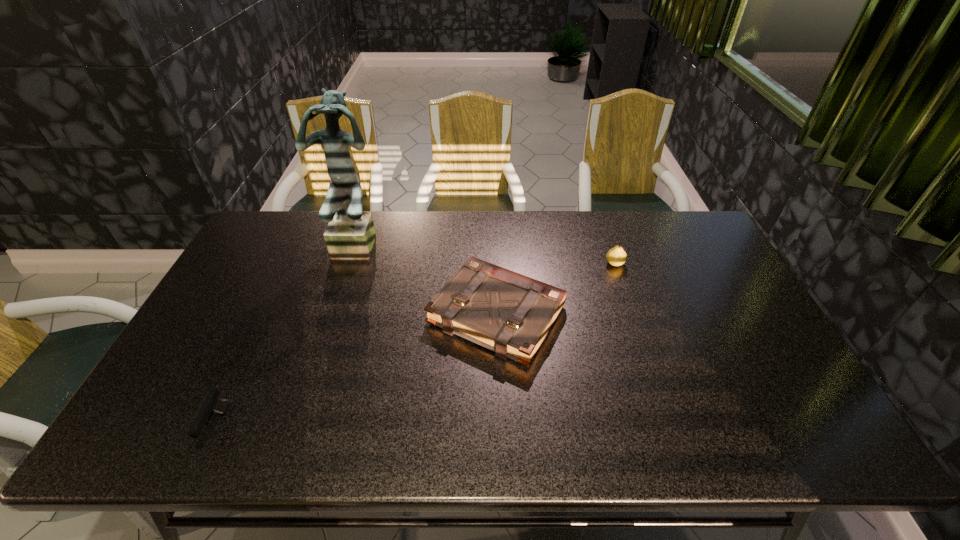
The width and height of the screenshot is (960, 540). I want to click on free space between the pistol and the third object from right to left, so click(x=289, y=334).

I want to click on free area in between the second object from left to right and the pear, so click(x=488, y=253).

Identify the location of vacant area that lies between the nearest object and the rightmost object. (416, 345).

Identify the location of the second closest object to the tallest object. (212, 404).

Where is `object that ranks as the third closest to the pistol`? The image size is (960, 540). object that ranks as the third closest to the pistol is located at coordinates (616, 256).

Image resolution: width=960 pixels, height=540 pixels. Identify the location of free space that satisfies the following two spatial constraints: 1. on the face of the hardback book; 2. on the right side of the tallest object. (338, 314).

This screenshot has height=540, width=960. Identify the location of blank space that satisfies the following two spatial constraints: 1. on the face of the second object from right to left; 2. on the left side of the sculpture. (338, 314).

I want to click on vacant region that satisfies the following two spatial constraints: 1. on the face of the rightmost object; 2. on the right side of the tallest object, so click(x=354, y=264).